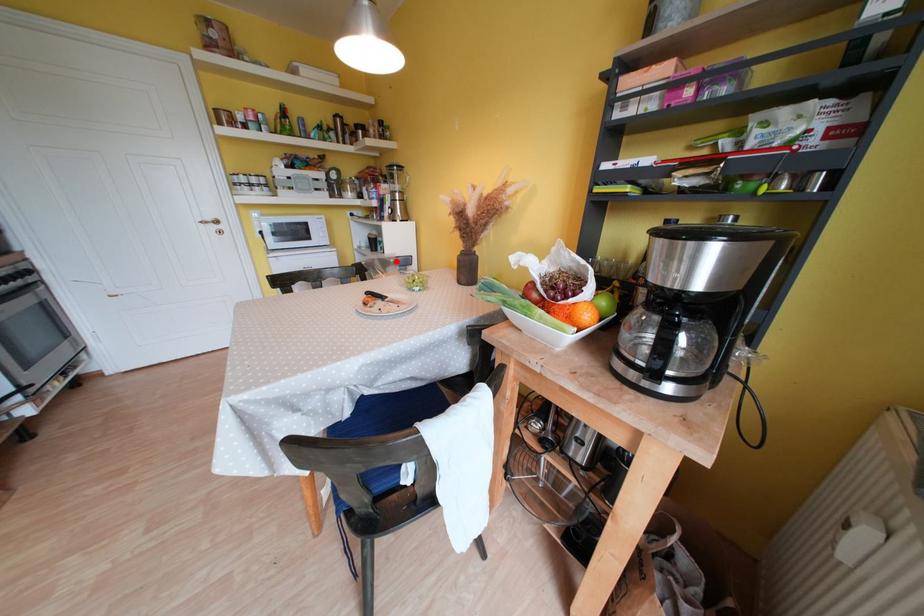
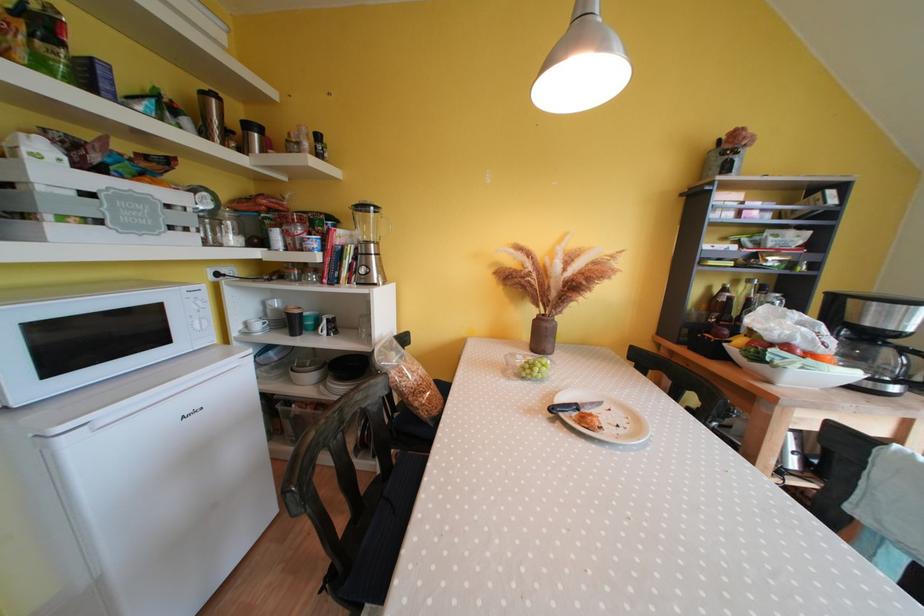
Where in the second image is the point corresponding to the highlighted location from the first image?

(397, 345)